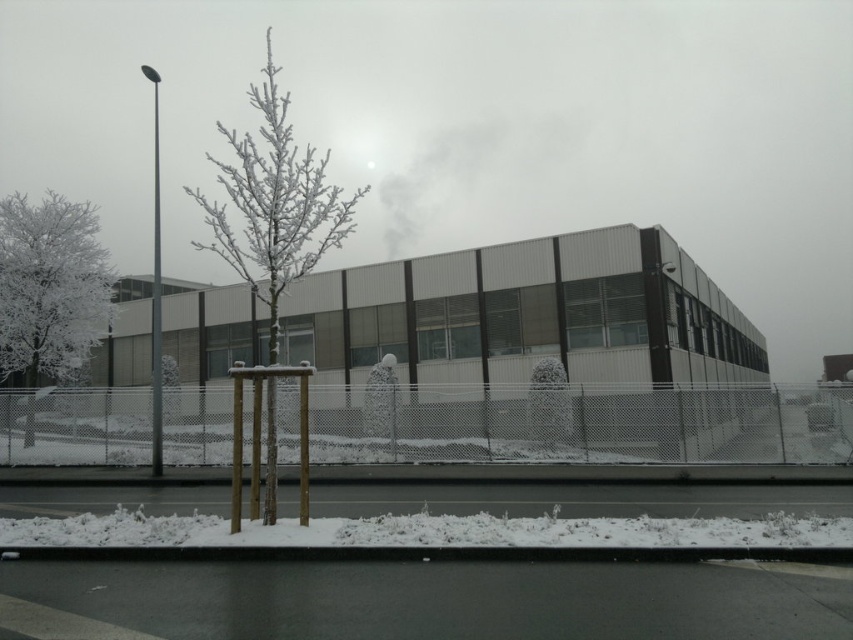
Does frosted white tree at center lie in front of white frosted tree at left?

That is True.

Can you confirm if frosted white tree at center is shorter than white frosted tree at left?

In fact, frosted white tree at center may be taller than white frosted tree at left.

You are a GUI agent. You are given a task and a screenshot of the screen. Output one action in this format:
    pyautogui.click(x=<x>, y=<y>)
    Task: Click on the frosted white tree at center
    
    Given the screenshot: What is the action you would take?
    pyautogui.click(x=271, y=260)

How distant is frosted white tree at center from white fluffy snow at lower center?

They are 46.81 meters apart.

What do you see at coordinates (271, 260) in the screenshot? The height and width of the screenshot is (640, 853). I see `frosted white tree at center` at bounding box center [271, 260].

Where is `frosted white tree at center`? frosted white tree at center is located at coordinates tap(271, 260).

Who is higher up, white fluffy snow at lower center or white frosted tree at left?

white frosted tree at left is higher up.

Is point (512, 536) positioned before point (15, 301)?

Yes, point (512, 536) is closer to viewer.

Between point (813, 522) and point (45, 264), which one is positioned behind?

Point (45, 264)

Where is `white fluffy snow at lower center`? white fluffy snow at lower center is located at coordinates (428, 531).